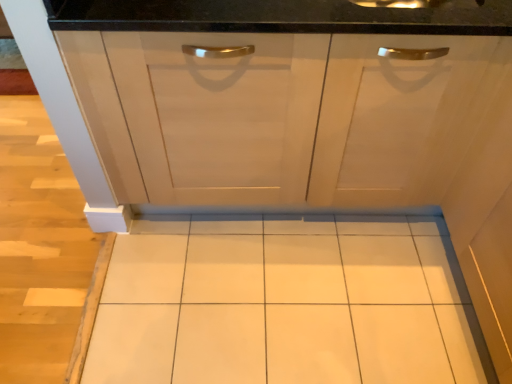
Question: Is point [x=336, y=49] closer or farther from the camera than point [x=292, y=266]?

Choices:
 (A) farther
 (B) closer

Answer: (B)

Question: Is matte white cabinet at center spatially inside white glossy tile at center, or outside of it?

Choices:
 (A) outside
 (B) inside

Answer: (A)

Question: From a real-world perspective, is matte white cabinet at center positioned above or below white glossy tile at center?

Choices:
 (A) below
 (B) above

Answer: (B)

Question: Visually, is white glossy tile at center positioned to the left or to the right of matte white cabinet at center?

Choices:
 (A) left
 (B) right

Answer: (A)

Question: From the image's perspective, is white glossy tile at center above or below matte white cabinet at center?

Choices:
 (A) below
 (B) above

Answer: (A)

Question: Is white glossy tile at center inside the boundaries of matte white cabinet at center, or outside?

Choices:
 (A) inside
 (B) outside

Answer: (B)

Question: In terms of height, does white glossy tile at center look taller or shorter compared to matte white cabinet at center?

Choices:
 (A) tall
 (B) short

Answer: (B)